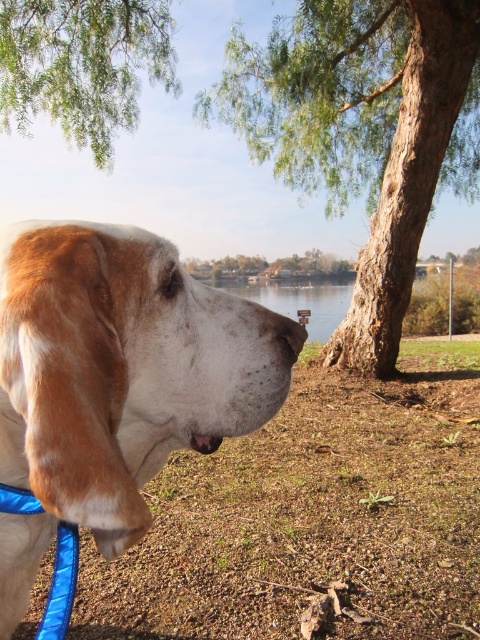
Question: Among these points, which one is nearest to the camera?

Choices:
 (A) (120, 513)
 (B) (285, 291)
 (C) (267, 266)

Answer: (A)

Question: Is green leafy tree at upper left thinner than brown textured tree at center?

Choices:
 (A) no
 (B) yes

Answer: (B)

Question: Can you confirm if brown fur dog at left is thinner than brown rough bark tree at upper center?

Choices:
 (A) yes
 (B) no

Answer: (A)

Question: Is brown fur dog at left bigger than clear water at center?

Choices:
 (A) yes
 (B) no

Answer: (B)

Question: Which point is farther from the camera taking this photo?

Choices:
 (A) coord(151,284)
 (B) coord(316,292)

Answer: (B)

Question: Which point appears farthest from the camera in this image?

Choices:
 (A) (37, 237)
 (B) (9, 1)

Answer: (B)